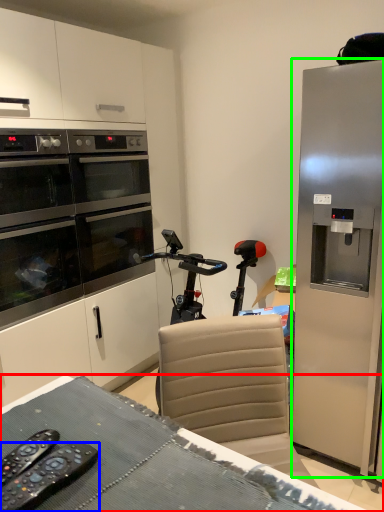
Question: Estimate the real-world distances between objects in this image. Which object is farther from desk (highlighted by a red box), remote control (highlighted by a blue box) or refrigerator (highlighted by a green box)?

Choices:
 (A) remote control
 (B) refrigerator

Answer: (B)